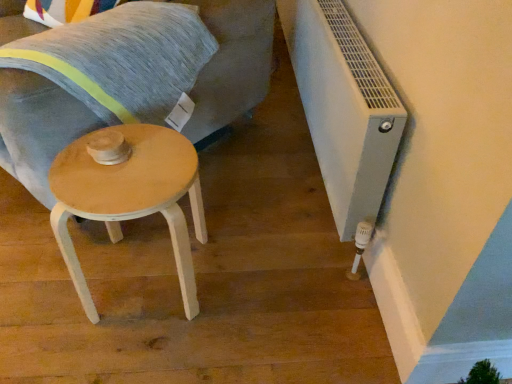
The image size is (512, 384). Find the location of `vacant region below light wood/wooden stool at lower left (from a real-world perspective)`. vacant region below light wood/wooden stool at lower left (from a real-world perspective) is located at coordinates (141, 278).